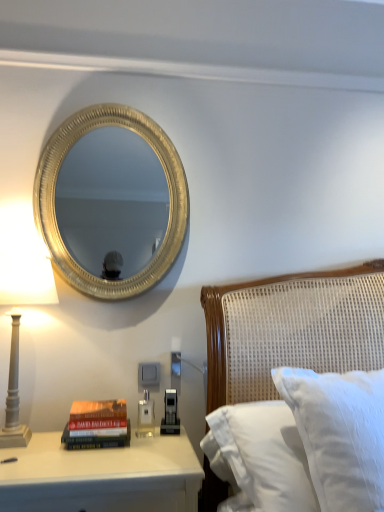
At what (x,y) coordinates should I click in order to perform the action: click on vacant area situated below gray columnar lamp at left (from a real-world perspective). Please return your answer as a coordinate pair (x, y). Looking at the image, I should click on (30, 443).